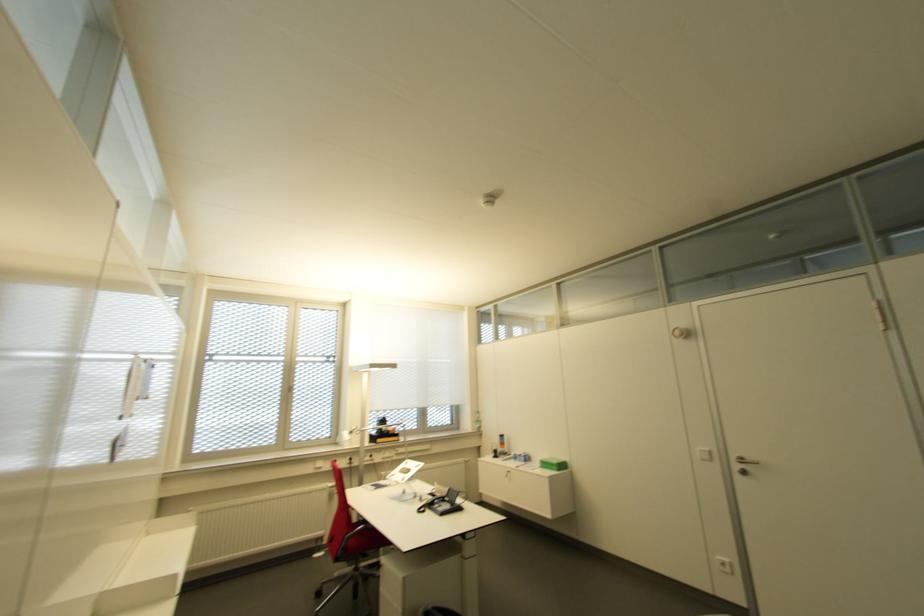
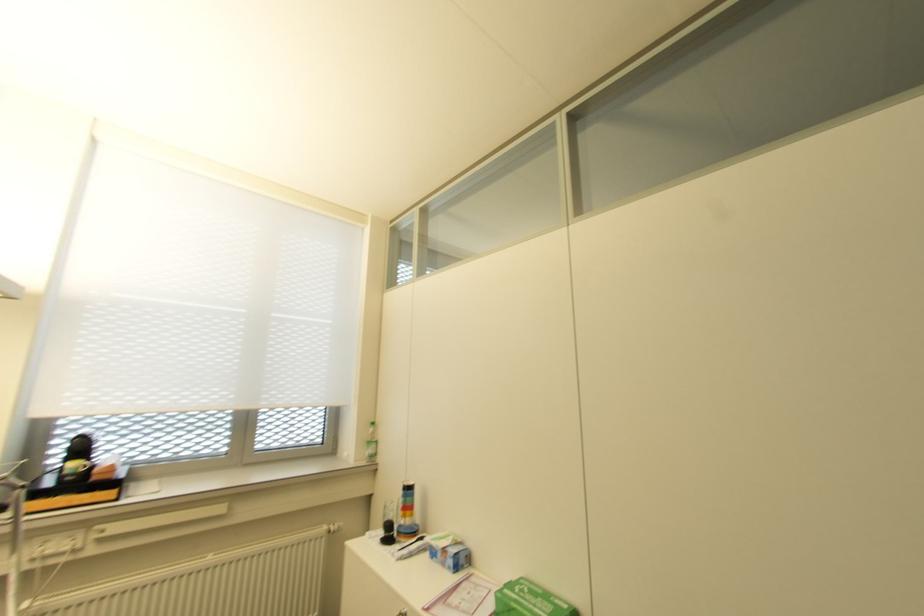
Where in the second image is the point corresponding to pixel 499 448 from the first image?

(402, 517)